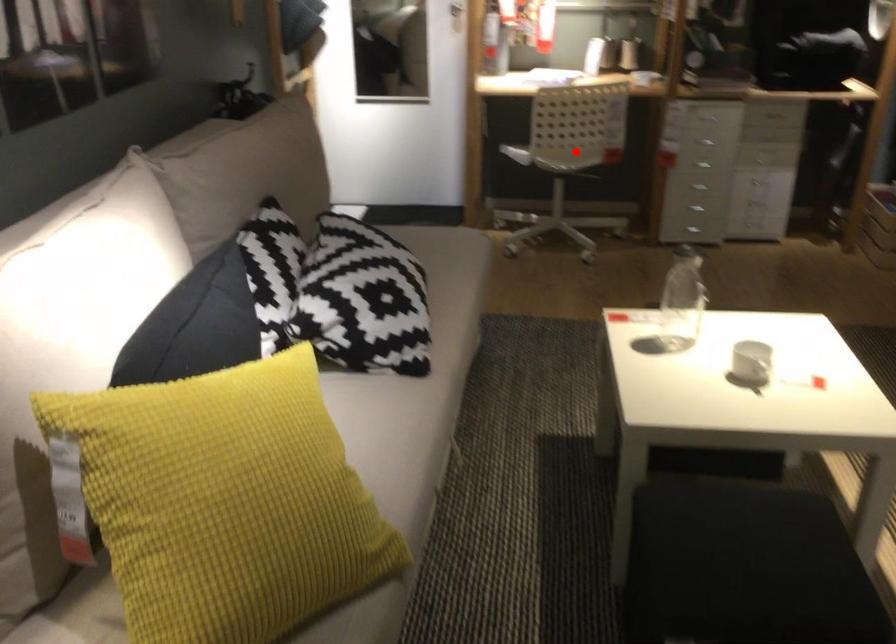
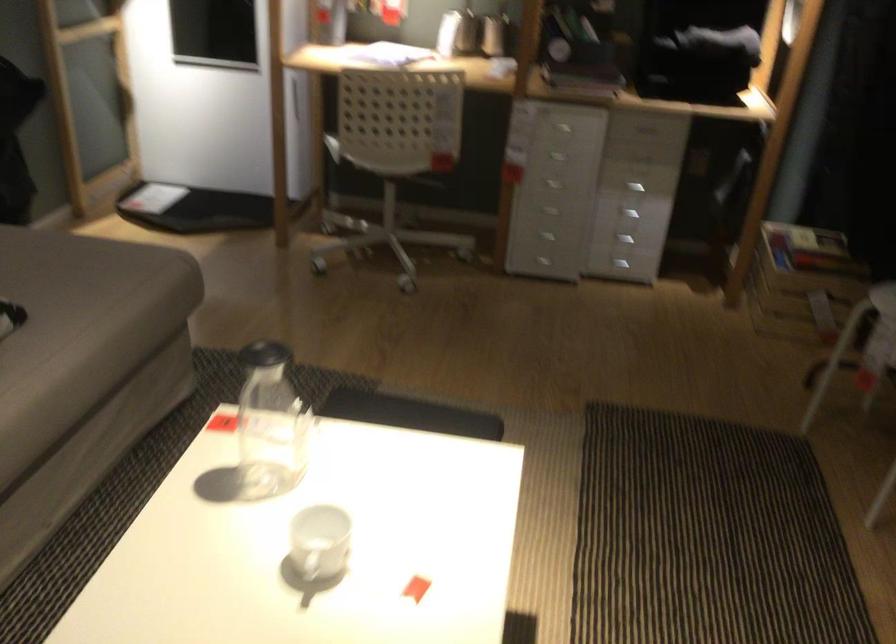
In the second image, find the point that corresponds to the highlighted location in the first image.

(388, 158)